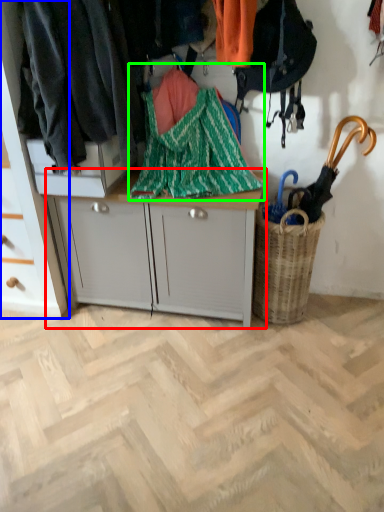
Question: Estimate the real-world distances between objects in this image. Which object is closer to desk (highlighted by a red box), cabinetry (highlighted by a blue box) or blanket (highlighted by a green box)?

Choices:
 (A) cabinetry
 (B) blanket

Answer: (B)